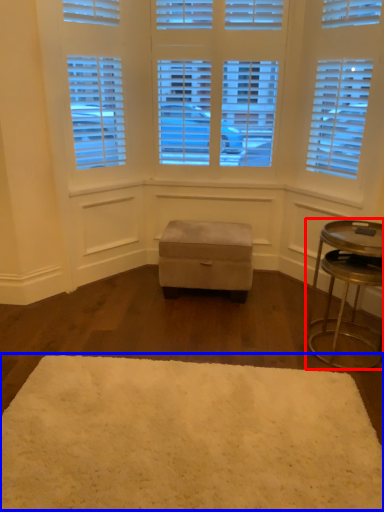
Question: Which object appears farthest to the camera in this image, table (highlighted by a red box) or mat (highlighted by a blue box)?

Choices:
 (A) table
 (B) mat

Answer: (A)